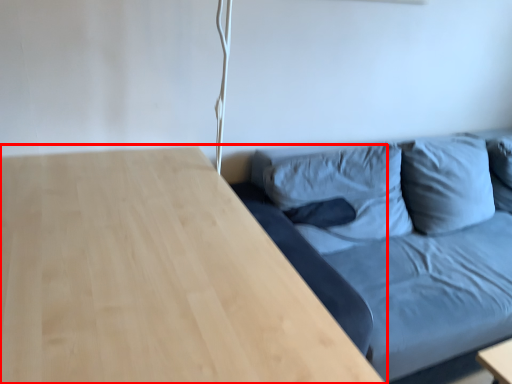
Question: From the image's perspective, what is the correct spatial positioning of table (annotated by the red box) in reference to studio couch?

Choices:
 (A) below
 (B) above

Answer: (A)